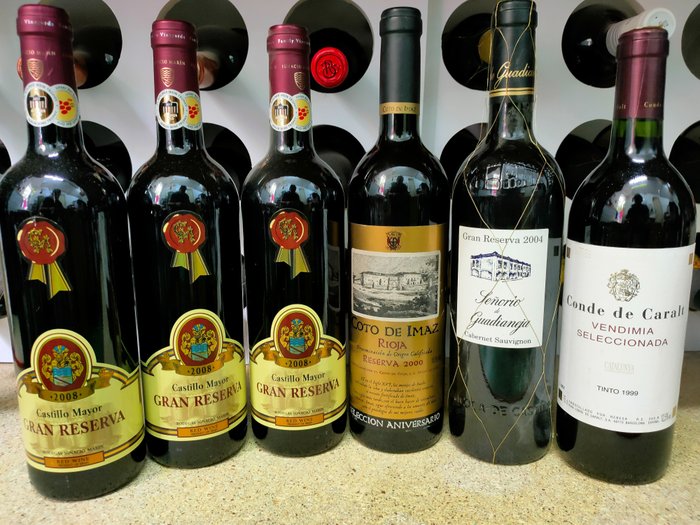
You are a GUI agent. You are given a task and a screenshot of the screen. Output one action in this format:
    pyautogui.click(x=<x>, y=<y>)
    Task: Click on the bottle
    
    Given the screenshot: What is the action you would take?
    pyautogui.click(x=309, y=443)